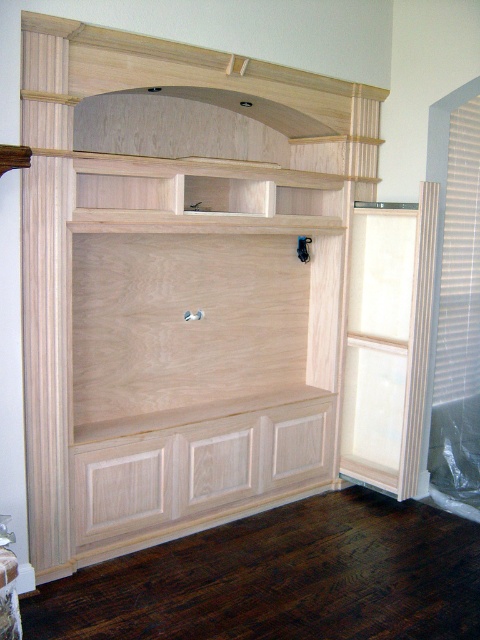
You are organizing a bookshelf and have a stack of books that need to be placed on the natural wood bookshelf at center. However, you also have a decorative vase that needs to be placed on the natural wood shelf at upper center. Based on their positions, which object should you place first to ensure proper arrangement?

You should place the decorative vase on the natural wood shelf at upper center first because the natural wood bookshelf at center is positioned under it, meaning the lower shelf should be arranged after the upper one to avoid blocking access.

You are standing in front of the entertainment unit and want to place a small decorative item on one of the two points mentioned. Which point is closer to you, point (62, 209) or point (104, 184)?

Point (62, 209) is closer to you because it is in front of point (104, 184).

Based on the photo, you are organizing books on the natural wood bookshelf at center and the natural wood shelf at upper center. Which one allows you to stack more books vertically?

The natural wood bookshelf at center allows you to stack more books vertically since it has a greater height compared to the natural wood shelf at upper center.